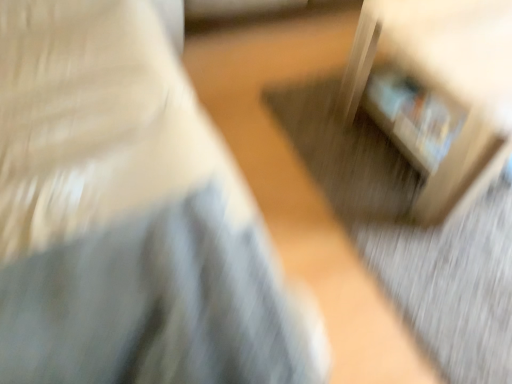
Describe the element at coordinates (444, 85) in the screenshot. I see `wooden crate at lower right, which is counted as the first furniture, starting from the right` at that location.

Identify the location of wooden crate at lower right, arranged as the second furniture when viewed from the left. The image size is (512, 384). (444, 85).

What do you see at coordinates (128, 216) in the screenshot? The width and height of the screenshot is (512, 384). I see `matte white bookshelf at upper right, which ranks as the 1th furniture in left-to-right order` at bounding box center [128, 216].

How much space does matte white bookshelf at upper right, which ranks as the 1th furniture in left-to-right order, occupy horizontally?

The width of matte white bookshelf at upper right, which ranks as the 1th furniture in left-to-right order, is 29.33 inches.

Locate an element on the screen. Image resolution: width=512 pixels, height=384 pixels. matte white bookshelf at upper right, which ranks as the 1th furniture in left-to-right order is located at coordinates (128, 216).

Identify the location of wooden crate at lower right, which is counted as the first furniture, starting from the right. The height and width of the screenshot is (384, 512). (444, 85).

Considering the relative positions of matte white bookshelf at upper right, the 2th furniture from the right, and wooden crate at lower right, arranged as the second furniture when viewed from the left, in the image provided, is matte white bookshelf at upper right, the 2th furniture from the right, to the left of wooden crate at lower right, arranged as the second furniture when viewed from the left, from the viewer's perspective?

Correct, you'll find matte white bookshelf at upper right, the 2th furniture from the right, to the left of wooden crate at lower right, arranged as the second furniture when viewed from the left.

Is the position of matte white bookshelf at upper right, which ranks as the 1th furniture in left-to-right order, more distant than that of wooden crate at lower right, which is counted as the first furniture, starting from the right?

No, matte white bookshelf at upper right, which ranks as the 1th furniture in left-to-right order, is closer to the camera.

Between point (77, 296) and point (429, 27), which one is positioned behind?

The point (429, 27) is more distant.

From the image's perspective, is matte white bookshelf at upper right, the 2th furniture from the right, above or below wooden crate at lower right, which is counted as the first furniture, starting from the right?

matte white bookshelf at upper right, the 2th furniture from the right, is situated higher than wooden crate at lower right, which is counted as the first furniture, starting from the right, in the image.

From a real-world perspective, is matte white bookshelf at upper right, which ranks as the 1th furniture in left-to-right order, positioned over wooden crate at lower right, arranged as the second furniture when viewed from the left, based on gravity?

Yes, from a real-world perspective, matte white bookshelf at upper right, which ranks as the 1th furniture in left-to-right order, is on top of wooden crate at lower right, arranged as the second furniture when viewed from the left.

Which of these two, matte white bookshelf at upper right, the 2th furniture from the right, or wooden crate at lower right, arranged as the second furniture when viewed from the left, is wider?

matte white bookshelf at upper right, the 2th furniture from the right, is wider.

Does matte white bookshelf at upper right, which ranks as the 1th furniture in left-to-right order, have a greater height compared to wooden crate at lower right, arranged as the second furniture when viewed from the left?

Indeed, matte white bookshelf at upper right, which ranks as the 1th furniture in left-to-right order, has a greater height compared to wooden crate at lower right, arranged as the second furniture when viewed from the left.

From the picture: Is matte white bookshelf at upper right, which ranks as the 1th furniture in left-to-right order, bigger than wooden crate at lower right, arranged as the second furniture when viewed from the left?

Yes.

Is matte white bookshelf at upper right, the 2th furniture from the right, not inside wooden crate at lower right, arranged as the second furniture when viewed from the left?

Yes, matte white bookshelf at upper right, the 2th furniture from the right, is outside of wooden crate at lower right, arranged as the second furniture when viewed from the left.

Is matte white bookshelf at upper right, the 2th furniture from the right, far from wooden crate at lower right, arranged as the second furniture when viewed from the left?

No, matte white bookshelf at upper right, the 2th furniture from the right, is not far away from wooden crate at lower right, arranged as the second furniture when viewed from the left.

Is matte white bookshelf at upper right, the 2th furniture from the right, oriented towards wooden crate at lower right, arranged as the second furniture when viewed from the left?

Yes.

How many degrees apart are the facing directions of matte white bookshelf at upper right, which ranks as the 1th furniture in left-to-right order, and wooden crate at lower right, which is counted as the first furniture, starting from the right?

The facing directions of matte white bookshelf at upper right, which ranks as the 1th furniture in left-to-right order, and wooden crate at lower right, which is counted as the first furniture, starting from the right, are 89.9 degrees apart.

How far apart are matte white bookshelf at upper right, the 2th furniture from the right, and wooden crate at lower right, arranged as the second furniture when viewed from the left?

72.79 centimeters.

This screenshot has width=512, height=384. What are the coordinates of `furniture on the left of the wooden crate at lower right, arranged as the second furniture when viewed from the left` in the screenshot? It's located at (128, 216).

From the picture: Does wooden crate at lower right, arranged as the second furniture when viewed from the left, appear on the left side of matte white bookshelf at upper right, the 2th furniture from the right?

In fact, wooden crate at lower right, arranged as the second furniture when viewed from the left, is to the right of matte white bookshelf at upper right, the 2th furniture from the right.

Is wooden crate at lower right, arranged as the second furniture when viewed from the left, in front of matte white bookshelf at upper right, the 2th furniture from the right?

No, the depth of wooden crate at lower right, arranged as the second furniture when viewed from the left, is greater than that of matte white bookshelf at upper right, the 2th furniture from the right.

Considering the positions of points (477, 127) and (174, 99), is point (477, 127) farther from camera compared to point (174, 99)?

No, (477, 127) is in front of (174, 99).

From the image's perspective, which one is positioned higher, wooden crate at lower right, which is counted as the first furniture, starting from the right, or matte white bookshelf at upper right, which ranks as the 1th furniture in left-to-right order?

matte white bookshelf at upper right, which ranks as the 1th furniture in left-to-right order, is shown above in the image.

From a real-world perspective, who is located higher, wooden crate at lower right, arranged as the second furniture when viewed from the left, or matte white bookshelf at upper right, the 2th furniture from the right?

matte white bookshelf at upper right, the 2th furniture from the right, from a real-world perspective.

Looking at their sizes, would you say wooden crate at lower right, arranged as the second furniture when viewed from the left, is wider or thinner than matte white bookshelf at upper right, the 2th furniture from the right?

Clearly, wooden crate at lower right, arranged as the second furniture when viewed from the left, has less width compared to matte white bookshelf at upper right, the 2th furniture from the right.

Considering the sizes of objects wooden crate at lower right, arranged as the second furniture when viewed from the left, and matte white bookshelf at upper right, which ranks as the 1th furniture in left-to-right order, in the image provided, who is shorter, wooden crate at lower right, arranged as the second furniture when viewed from the left, or matte white bookshelf at upper right, which ranks as the 1th furniture in left-to-right order,?

Standing shorter between the two is wooden crate at lower right, arranged as the second furniture when viewed from the left.

Which of these two, wooden crate at lower right, arranged as the second furniture when viewed from the left, or matte white bookshelf at upper right, which ranks as the 1th furniture in left-to-right order, is smaller?

With smaller size is wooden crate at lower right, arranged as the second furniture when viewed from the left.

Is wooden crate at lower right, arranged as the second furniture when viewed from the left, outside of matte white bookshelf at upper right, which ranks as the 1th furniture in left-to-right order?

That's correct, wooden crate at lower right, arranged as the second furniture when viewed from the left, is outside of matte white bookshelf at upper right, which ranks as the 1th furniture in left-to-right order.

Is wooden crate at lower right, arranged as the second furniture when viewed from the left, beside matte white bookshelf at upper right, which ranks as the 1th furniture in left-to-right order?

wooden crate at lower right, arranged as the second furniture when viewed from the left, and matte white bookshelf at upper right, which ranks as the 1th furniture in left-to-right order, are not in contact.

Is wooden crate at lower right, which is counted as the first furniture, starting from the right, facing towards matte white bookshelf at upper right, the 2th furniture from the right?

No, wooden crate at lower right, which is counted as the first furniture, starting from the right, is not facing towards matte white bookshelf at upper right, the 2th furniture from the right.

Consider the image. Could you measure the distance between wooden crate at lower right, arranged as the second furniture when viewed from the left, and matte white bookshelf at upper right, the 2th furniture from the right?

wooden crate at lower right, arranged as the second furniture when viewed from the left, and matte white bookshelf at upper right, the 2th furniture from the right, are 28.66 inches apart from each other.

Where is `furniture above the wooden crate at lower right, arranged as the second furniture when viewed from the left (from the image's perspective)`? This screenshot has height=384, width=512. furniture above the wooden crate at lower right, arranged as the second furniture when viewed from the left (from the image's perspective) is located at coordinates [x=128, y=216].

This screenshot has height=384, width=512. In order to click on furniture below the matte white bookshelf at upper right, which ranks as the 1th furniture in left-to-right order (from the image's perspective) in this screenshot , I will do `click(444, 85)`.

Find the location of a particular element. furniture in front of the wooden crate at lower right, arranged as the second furniture when viewed from the left is located at coordinates coord(128,216).